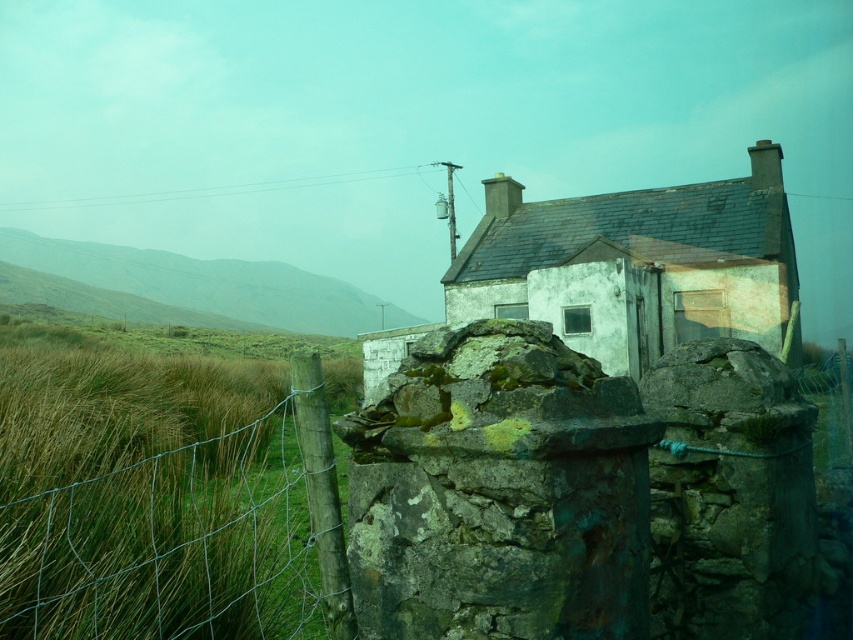
Question: Considering the relative positions of white stone cottage at center and green grassy hillside at left in the image provided, where is white stone cottage at center located with respect to green grassy hillside at left?

Choices:
 (A) above
 (B) below

Answer: (B)

Question: Which point appears farthest from the camera in this image?

Choices:
 (A) (59, 412)
 (B) (76, 260)

Answer: (B)

Question: Where is green wire fence at left located in relation to white stone cottage at center in the image?

Choices:
 (A) above
 (B) below

Answer: (B)

Question: Which object is the farthest from the green grassy hillside at left?

Choices:
 (A) white stone cottage at center
 (B) green wire fence at left

Answer: (B)

Question: Can you confirm if white stone cottage at center is positioned above green grassy hillside at left?

Choices:
 (A) yes
 (B) no

Answer: (B)

Question: Which of the following is the closest to the observer?

Choices:
 (A) green wire fence at left
 (B) white stone cottage at center
 (C) green grassy hillside at left

Answer: (A)